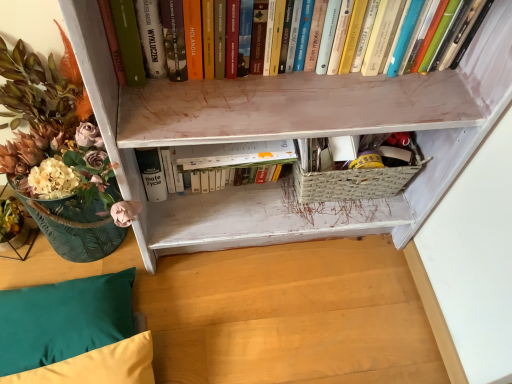
Locate an element on the screen. The width and height of the screenshot is (512, 384). free spot above teal fabric pillow at lower left, the first pillow viewed from the top (from a real-world perspective) is located at coordinates (51, 319).